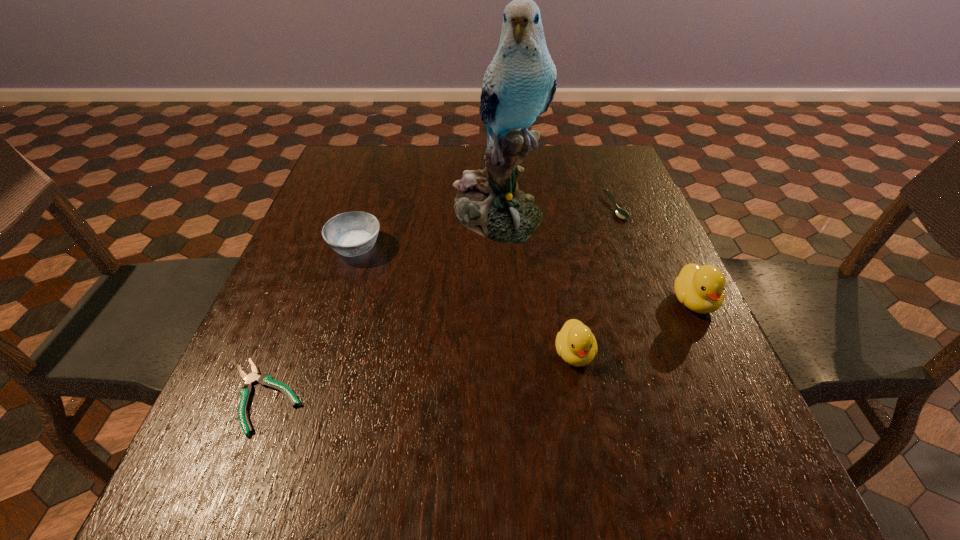
In the current image, all ducklings are evenly spaced. To maintain this equal spacing, where should an additional duckling be placed on the left? Please point out a free spot. Please provide its 2D coordinates. Your answer should be formatted as a tuple, i.e. [(x, y)], where the tuple contains the x and y coordinates of a point satisfying the conditions above.

[(424, 418)]